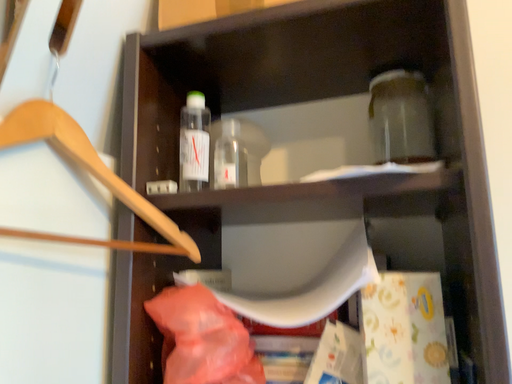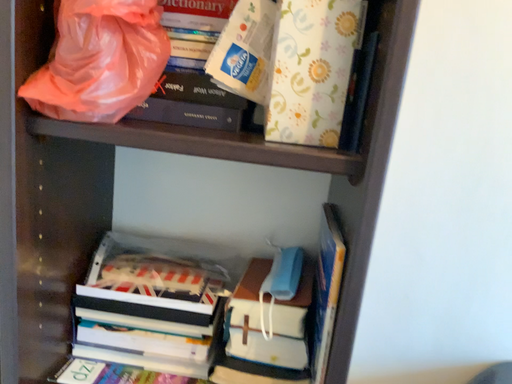
Question: How did the camera likely rotate when shooting the video?

Choices:
 (A) rotated upward
 (B) rotated downward

Answer: (B)